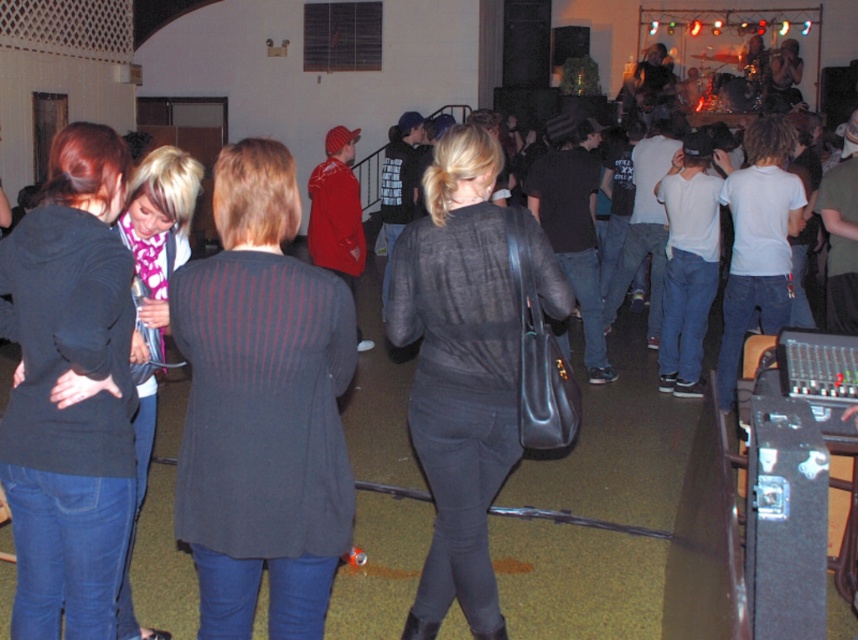
Question: Does dark gray textured sweater at center have a lesser width compared to matte black hoodie at left?

Choices:
 (A) no
 (B) yes

Answer: (A)

Question: Among these objects, which one is farthest from the camera?

Choices:
 (A) dark gray textured sweater at center
 (B) matte black hoodie at left
 (C) matte black shirt at center

Answer: (C)

Question: Estimate the real-world distances between objects in this image. Which object is farther from the matte black hoodie at left?

Choices:
 (A) matte black shirt at center
 (B) dark gray textured sweater at center

Answer: (A)

Question: Which of the following is the farthest from the observer?

Choices:
 (A) (470, 440)
 (B) (26, 285)
 (C) (198, 368)

Answer: (A)

Question: Does dark gray textured sweater at center come behind matte black shirt at center?

Choices:
 (A) yes
 (B) no

Answer: (B)

Question: Does dark gray textured sweater at center have a larger size compared to matte black hoodie at left?

Choices:
 (A) yes
 (B) no

Answer: (A)